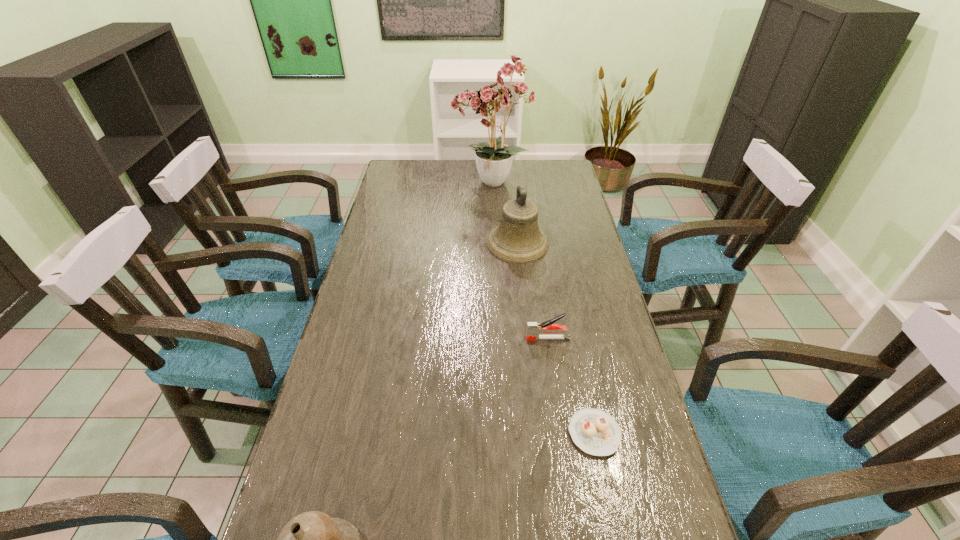
Where is `free space at the far edge`? The height and width of the screenshot is (540, 960). free space at the far edge is located at coordinates (469, 165).

Where is `free space at the left edge of the desktop`? free space at the left edge of the desktop is located at coordinates (402, 212).

In the image, there is a desktop. Where is `free region at the right edge`? This screenshot has width=960, height=540. free region at the right edge is located at coordinates (563, 245).

The width and height of the screenshot is (960, 540). I want to click on vacant space at the far left corner of the desktop, so click(420, 165).

I want to click on vacant space at the far right corner of the desktop, so click(x=561, y=164).

Find the location of a particular element. free space between the fourth farthest object and the tallest object is located at coordinates (542, 308).

The width and height of the screenshot is (960, 540). In order to click on free space between the fourth tallest object and the taller bell in this screenshot , I will do `click(533, 291)`.

Image resolution: width=960 pixels, height=540 pixels. In order to click on object that stands as the second closest to the second shortest object in this screenshot , I will do `click(518, 239)`.

Choose which object is the nearest neighbor to the third farthest object. Please provide its 2D coordinates. Your answer should be formatted as a tuple, i.e. [(x, y)], where the tuple contains the x and y coordinates of a point satisfying the conditions above.

[(595, 432)]

Identify the location of vacant space that satisfies the following two spatial constraints: 1. on the handle side of the second nearest object; 2. on the right side of the stapler. (562, 434).